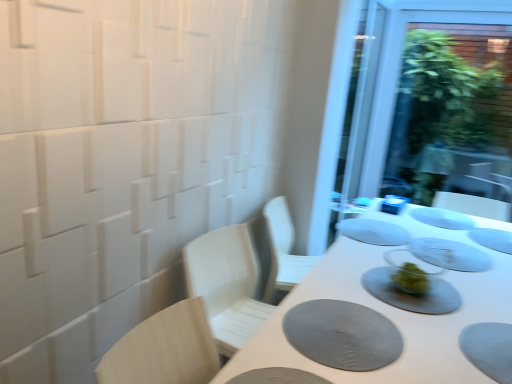
Find the location of a particular element. Image resolution: width=512 pixels, height=384 pixels. free space below white matte plate at center, arranged as the 2th tableware when viewed from the back (from a real-world perspective) is located at coordinates (429, 215).